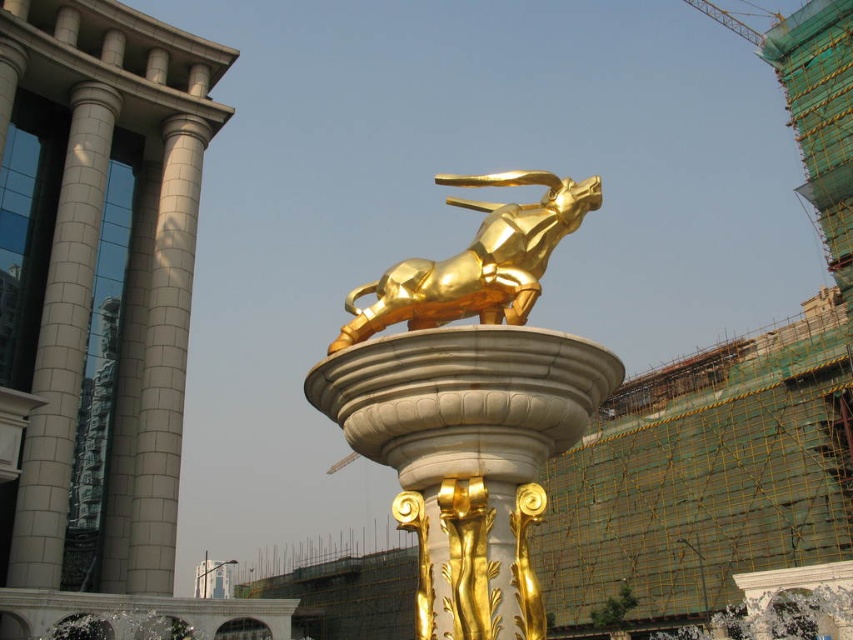
Question: Can you confirm if gold polished statue at center is bigger than gold polished bull at center?

Choices:
 (A) yes
 (B) no

Answer: (A)

Question: Where is gold polished statue at center located in relation to gold polished bull at center in the image?

Choices:
 (A) above
 (B) below

Answer: (B)

Question: Does gold polished statue at center have a larger size compared to gold polished bull at center?

Choices:
 (A) no
 (B) yes

Answer: (B)

Question: Which point is farther to the camera?

Choices:
 (A) gold polished statue at center
 (B) gold polished bull at center

Answer: (B)